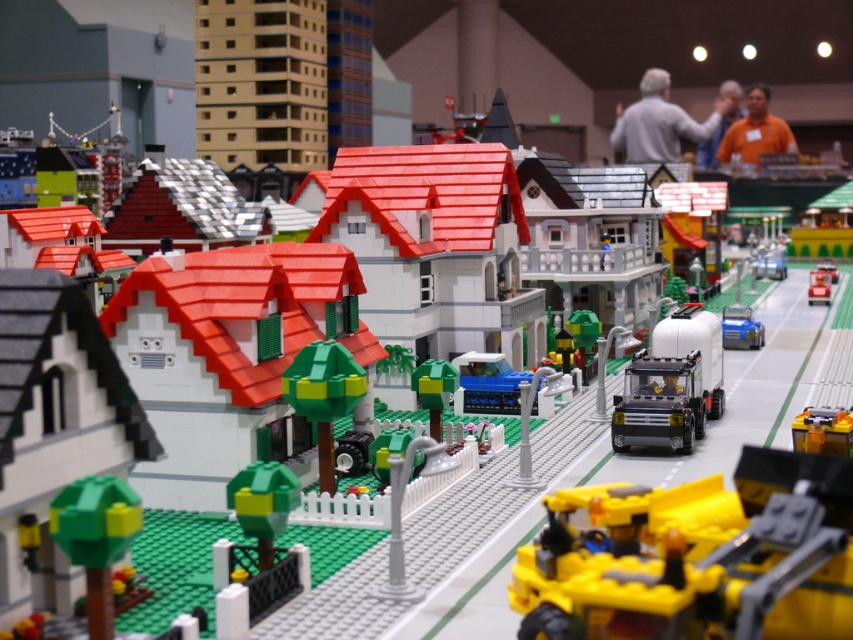
You are a Lego figure standing at the bottom left corner of the baseplate. You need to reach the yellow plastic truck at center as quickly as possible. Which direction should you move first?

Since the yellow plastic truck at center is located at point 0.673 on the x axis and 0.966 on the y axis, you should move to the right first to increase your x coordinate before moving upwards to reach the truck.